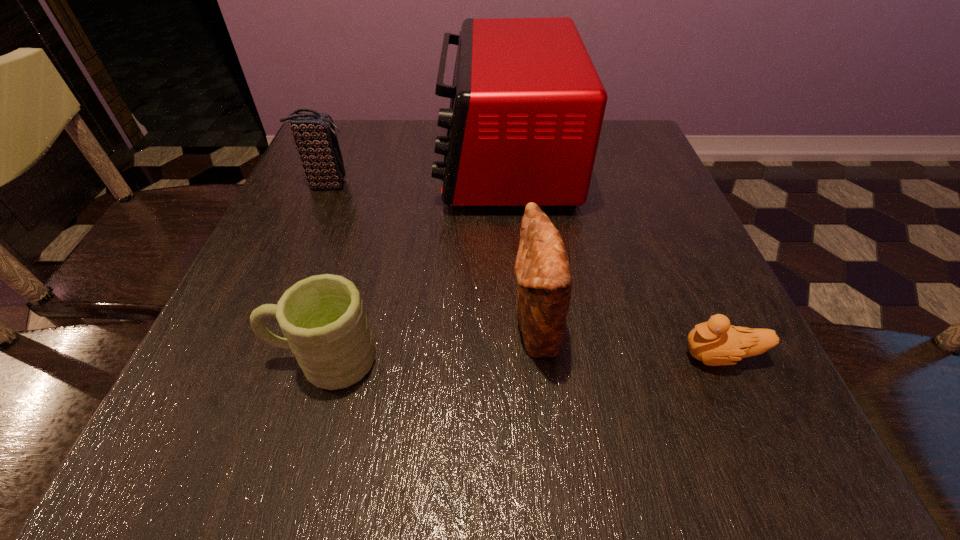
This screenshot has height=540, width=960. I want to click on toaster oven, so click(x=527, y=105).

Identify the location of the right clutch bag. (542, 269).

In order to click on the farther clutch bag in this screenshot , I will do `click(314, 134)`.

I want to click on mug, so click(322, 318).

Locate an element on the screen. This screenshot has width=960, height=540. the shortest object is located at coordinates (715, 342).

The image size is (960, 540). Find the location of `duckling`. duckling is located at coordinates (715, 342).

Identify the location of vacant point located 0.060m on the front-facing side of the toaster oven. (413, 161).

Find the location of `vacant space located 0.260m on the front-facing side of the toaster oven`. vacant space located 0.260m on the front-facing side of the toaster oven is located at coordinates (325, 161).

Locate an element on the screen. The height and width of the screenshot is (540, 960). free region located 0.100m on the front-facing side of the toaster oven is located at coordinates [x=396, y=161].

Identify the location of free space located on the open side of the nearer clutch bag. (394, 327).